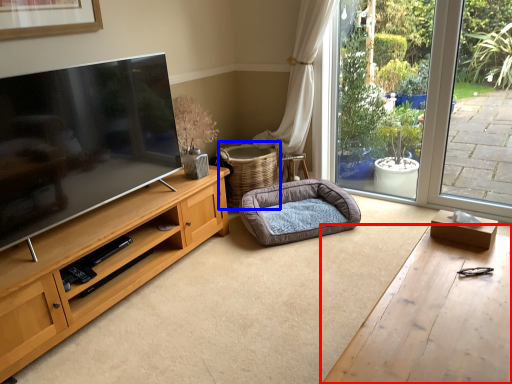
Question: Which object appears farthest to the camera in this image, desk (highlighted by a red box) or basket (highlighted by a blue box)?

Choices:
 (A) desk
 (B) basket

Answer: (B)